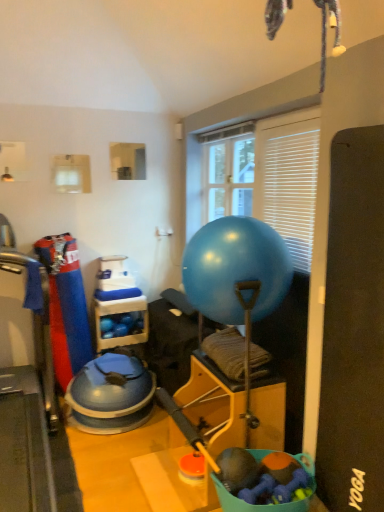
Question: Is blue rubber mat at left bigger or smaller than rubberized fabric dog toy at lower center?

Choices:
 (A) small
 (B) big

Answer: (B)

Question: Is point (46, 461) closer or farther from the camera than point (279, 505)?

Choices:
 (A) farther
 (B) closer

Answer: (A)

Question: Which object is the closest to the rubberized fabric dog toy at lower center?

Choices:
 (A) white blinds at upper right, which is counted as the 2th window screen, starting from the left
 (B) blue rubber mat at left
 (C) blue rubber ball at center
 (D) transparent plastic window screen at center, the first window screen positioned from the back

Answer: (C)

Question: Considering the real-world distances, which object is closest to the transparent plastic window screen at center, the first window screen positioned from the back?

Choices:
 (A) white blinds at upper right, which is counted as the 2th window screen, starting from the left
 (B) blue rubber mat at left
 (C) blue rubber ball at center
 (D) rubberized fabric dog toy at lower center

Answer: (A)